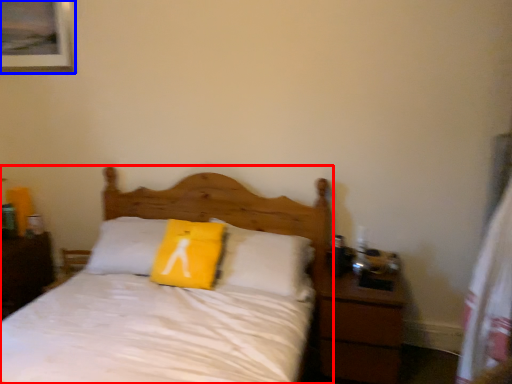
Question: Which of the following is the closest to the observer, bed (highlighted by a red box) or picture frame (highlighted by a blue box)?

Choices:
 (A) bed
 (B) picture frame

Answer: (A)